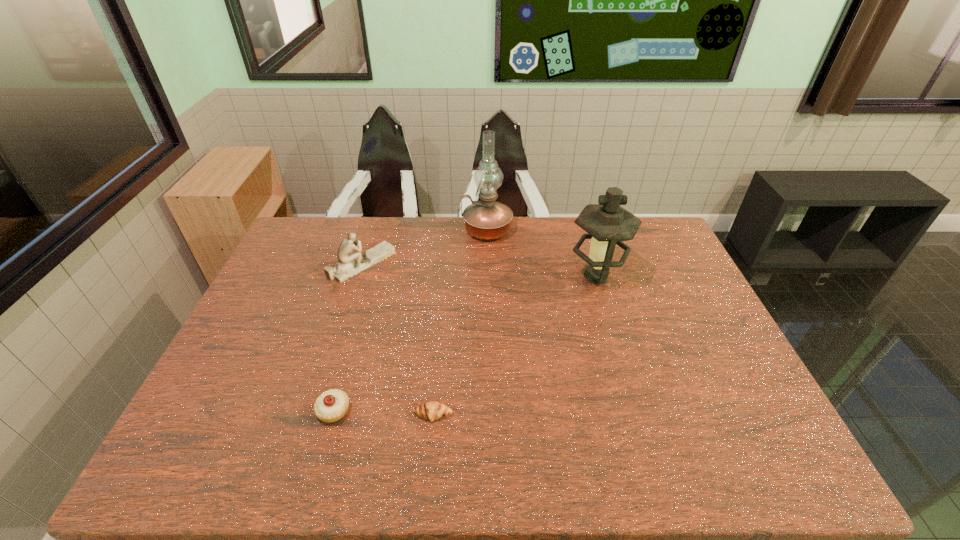
At what (x,y) coordinates should I click in order to perform the action: click on free space that satisfies the following two spatial constraints: 1. on the front-facing side of the figurine; 2. on the back side of the right oil lamp. Please return your answer as a coordinate pair (x, y). The image size is (960, 540). Looking at the image, I should click on (358, 276).